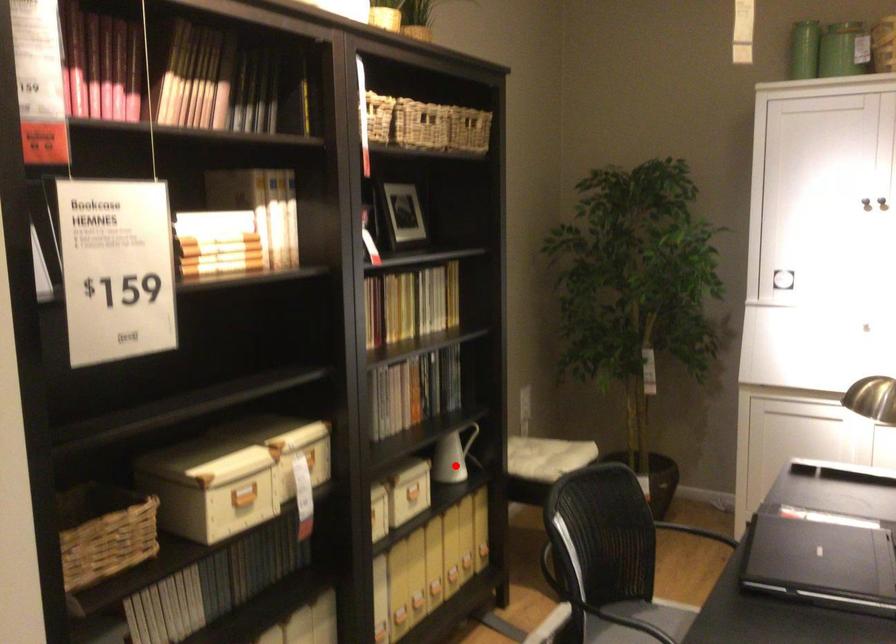
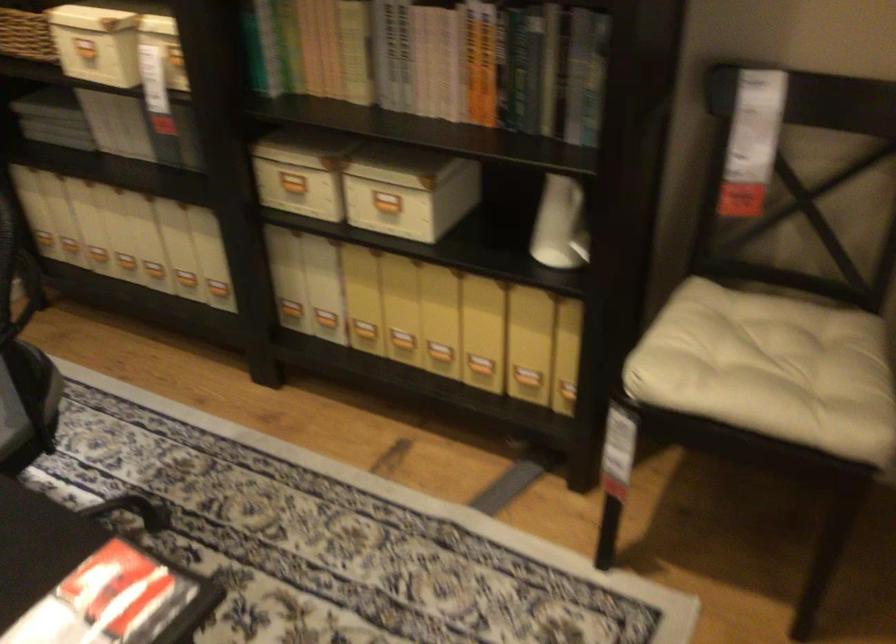
Find the pixel in the second image that matches the highlighted location in the first image.

(582, 238)